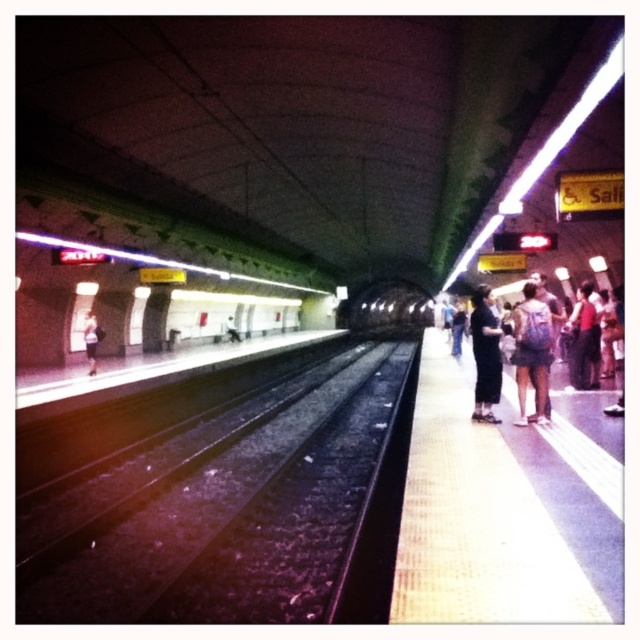
Question: Does blue backpack at right have a smaller size compared to black fabric pants at center?

Choices:
 (A) no
 (B) yes

Answer: (B)

Question: Which point appears closest to the camera in this image?

Choices:
 (A) pos(488,541)
 (B) pos(86,346)
 (C) pos(480,353)

Answer: (A)

Question: Which object is the farthest from the dark blue jeans at left?

Choices:
 (A) blue backpack at right
 (B) black asphalt train track at center
 (C) yellow textured platform at right
 (D) black fabric pants at center

Answer: (A)

Question: Is blue backpack at right smaller than black fabric pants at center?

Choices:
 (A) no
 (B) yes

Answer: (B)

Question: Which of the following is the closest to the observer?

Choices:
 (A) (448, 368)
 (B) (332, 483)
 (C) (474, 403)

Answer: (C)

Question: Is black asphalt train track at center further to the viewer compared to black fabric pants at center?

Choices:
 (A) no
 (B) yes

Answer: (A)